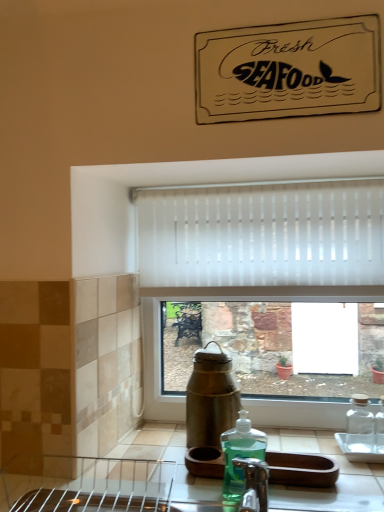
Question: In which direction should I rotate to look at green translucent liquid soap at lower center?

Choices:
 (A) left
 (B) right

Answer: (B)

Question: From a real-world perspective, is green translucent liquid soap at lower center physically above white translucent blinds at center?

Choices:
 (A) no
 (B) yes

Answer: (A)

Question: Is green translucent liquid soap at lower center shorter than white translucent blinds at center?

Choices:
 (A) yes
 (B) no

Answer: (A)

Question: Could white translucent blinds at center be considered to be inside green translucent liquid soap at lower center?

Choices:
 (A) yes
 (B) no

Answer: (B)

Question: Is green translucent liquid soap at lower center looking in the opposite direction of white translucent blinds at center?

Choices:
 (A) no
 (B) yes

Answer: (A)

Question: Is green translucent liquid soap at lower center taller than white translucent blinds at center?

Choices:
 (A) yes
 (B) no

Answer: (B)

Question: Is green translucent liquid soap at lower center wider than white translucent blinds at center?

Choices:
 (A) yes
 (B) no

Answer: (A)

Question: Does white translucent blinds at center have a smaller size compared to green translucent liquid soap at lower center?

Choices:
 (A) yes
 (B) no

Answer: (B)

Question: From the image's perspective, is white translucent blinds at center over green translucent liquid soap at lower center?

Choices:
 (A) yes
 (B) no

Answer: (A)

Question: Considering the relative positions of white translucent blinds at center and green translucent liquid soap at lower center in the image provided, is white translucent blinds at center to the left of green translucent liquid soap at lower center from the viewer's perspective?

Choices:
 (A) no
 (B) yes

Answer: (A)

Question: Considering the relative sizes of white translucent blinds at center and green translucent liquid soap at lower center in the image provided, is white translucent blinds at center bigger than green translucent liquid soap at lower center?

Choices:
 (A) yes
 (B) no

Answer: (A)

Question: From a real-world perspective, is white translucent blinds at center beneath green translucent liquid soap at lower center?

Choices:
 (A) no
 (B) yes

Answer: (A)

Question: Could you tell me if white translucent blinds at center is facing green translucent liquid soap at lower center?

Choices:
 (A) no
 (B) yes

Answer: (A)

Question: Relative to white translucent blinds at center, is green translucent liquid soap at lower center in front or behind?

Choices:
 (A) behind
 (B) front

Answer: (B)